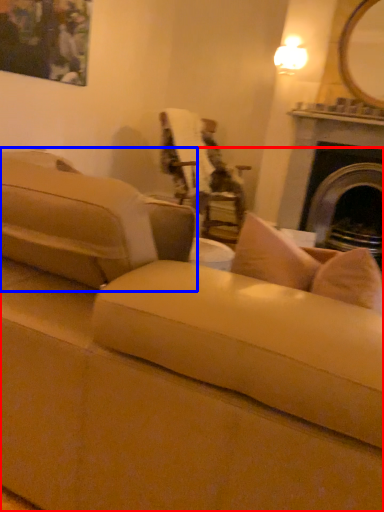
Question: Among these objects, which one is nearest to the camera, studio couch (highlighted by a red box) or studio couch (highlighted by a blue box)?

Choices:
 (A) studio couch
 (B) studio couch

Answer: (A)